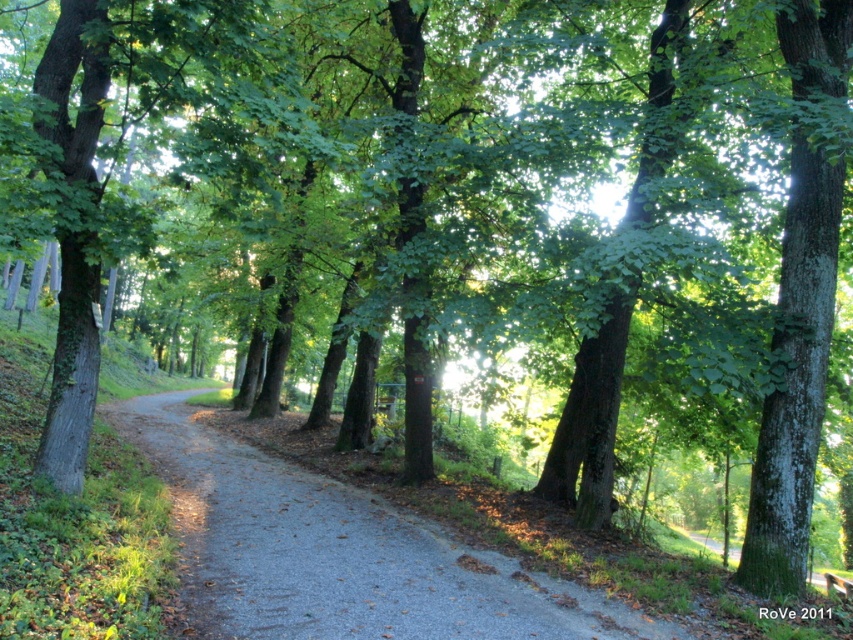
Question: Does gray gravel path at center have a smaller size compared to green rough bark tree at right?

Choices:
 (A) yes
 (B) no

Answer: (B)

Question: Does gray gravel path at center have a lesser width compared to green rough bark tree at right?

Choices:
 (A) no
 (B) yes

Answer: (A)

Question: Which object appears farthest from the camera in this image?

Choices:
 (A) green rough bark tree at right
 (B) gray gravel path at center

Answer: (A)

Question: Where is gray gravel path at center located in relation to green rough bark tree at right in the image?

Choices:
 (A) above
 (B) below

Answer: (B)

Question: Which of the following is the closest to the observer?

Choices:
 (A) gray gravel path at center
 (B) green rough bark tree at right

Answer: (A)